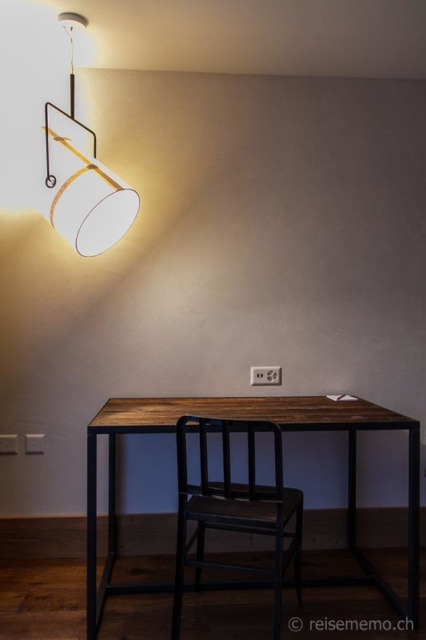
Can you confirm if rustic wood table at center is bigger than matte white lampshade at upper left?

Yes, rustic wood table at center is bigger than matte white lampshade at upper left.

Between rustic wood table at center and matte white lampshade at upper left, which one is positioned lower?

rustic wood table at center is lower down.

The width and height of the screenshot is (426, 640). Describe the element at coordinates (253, 419) in the screenshot. I see `rustic wood table at center` at that location.

This screenshot has height=640, width=426. I want to click on rustic wood table at center, so click(253, 419).

Is rustic wood table at center positioned in front of black matte chair at center?

No, rustic wood table at center is behind black matte chair at center.

Measure the distance from rustic wood table at center to black matte chair at center.

The distance of rustic wood table at center from black matte chair at center is 11.72 inches.

Does point (267, 401) come in front of point (296, 540)?

No.

This screenshot has width=426, height=640. Identify the location of rustic wood table at center. 253,419.

Is black matte chair at center below matte white lampshade at upper left?

Correct, black matte chair at center is located below matte white lampshade at upper left.

Who is lower down, black matte chair at center or matte white lampshade at upper left?

black matte chair at center is lower down.

Is point (270, 572) farther from viewer compared to point (69, 145)?

No, it is not.

This screenshot has height=640, width=426. I want to click on black matte chair at center, so click(235, 509).